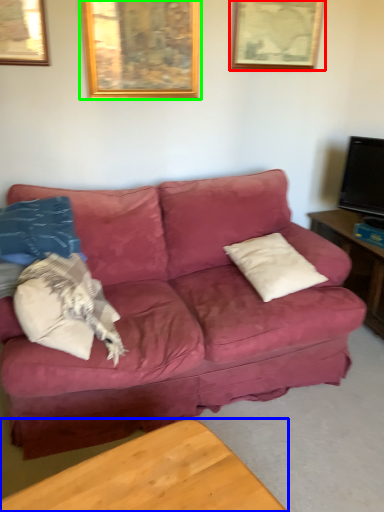
Question: Based on their relative distances, which object is nearer to picture frame (highlighted by a red box)? Choose from table (highlighted by a blue box) and picture frame (highlighted by a green box).

Choices:
 (A) table
 (B) picture frame

Answer: (B)